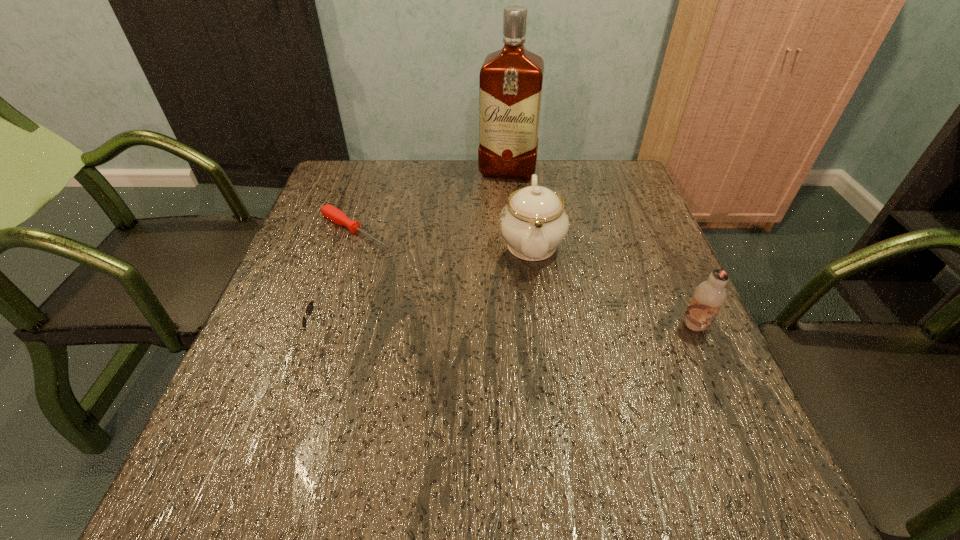
Find the location of a particular element. vacant area that satisfies the following two spatial constraints: 1. on the front side of the shortest object; 2. on the left side of the chocolate milk is located at coordinates (324, 326).

Locate an element on the screen. This screenshot has height=540, width=960. vacant space that satisfies the following two spatial constraints: 1. on the front side of the chinaware; 2. on the left side of the shortest object is located at coordinates (351, 244).

Where is `vacant position in the image that satisfies the following two spatial constraints: 1. on the back side of the shortest object; 2. on the right side of the liquor`? The height and width of the screenshot is (540, 960). vacant position in the image that satisfies the following two spatial constraints: 1. on the back side of the shortest object; 2. on the right side of the liquor is located at coordinates (375, 172).

The width and height of the screenshot is (960, 540). Identify the location of vacant space that satisfies the following two spatial constraints: 1. on the front side of the chinaware; 2. on the right side of the rightmost object. (542, 326).

I want to click on vacant area in the image that satisfies the following two spatial constraints: 1. on the front side of the tallest object; 2. on the right side of the rightmost object, so click(521, 326).

This screenshot has height=540, width=960. Find the location of `free space that satisfies the following two spatial constraints: 1. on the back side of the screwdriver; 2. on the right side of the farthest object`. free space that satisfies the following two spatial constraints: 1. on the back side of the screwdriver; 2. on the right side of the farthest object is located at coordinates (375, 172).